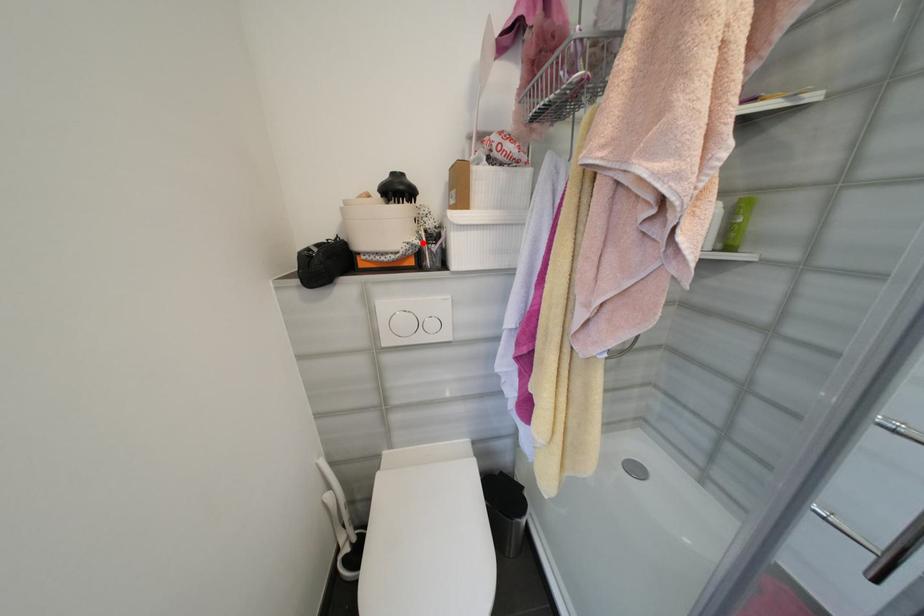
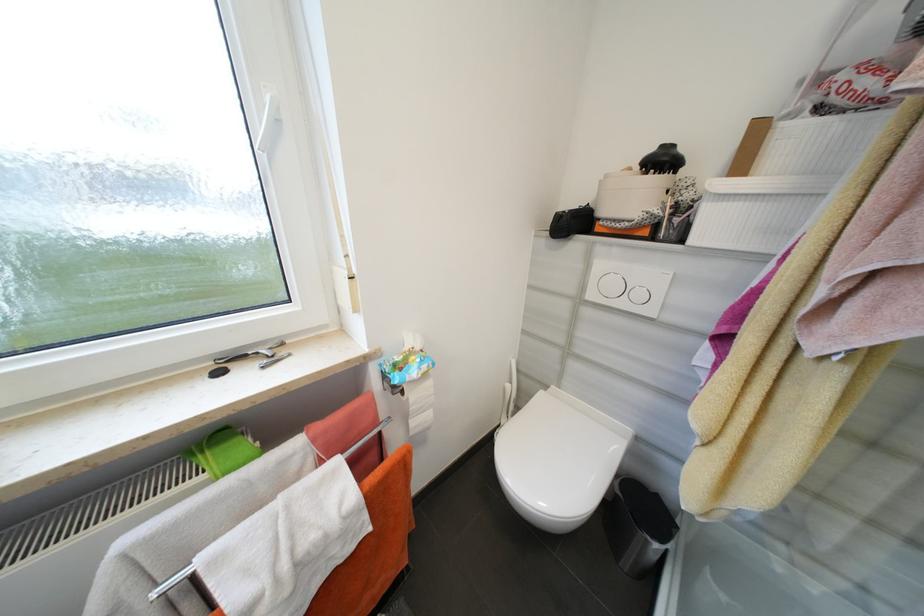
Locate, in the second image, the point that corresponds to the highlighted location in the first image.

(663, 213)